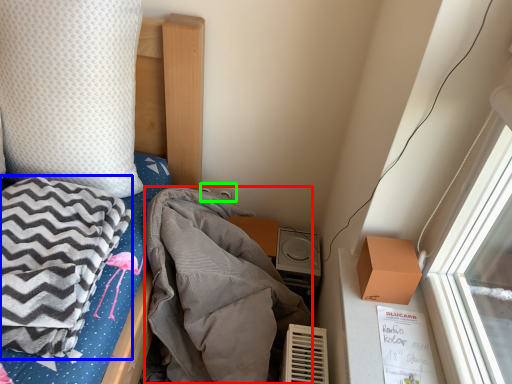
Question: Which object is positioned farthest from blanket (highlighted by a red box)? Select from blanket (highlighted by a blue box) and power plugs and sockets (highlighted by a green box).

Choices:
 (A) blanket
 (B) power plugs and sockets

Answer: (B)